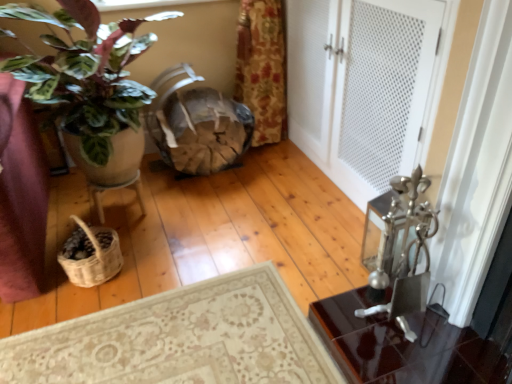
Question: Are woven natural fiber basket at lower left and matte brown pot at left far apart?

Choices:
 (A) yes
 (B) no

Answer: (B)

Question: Is woven natural fiber basket at lower left oriented away from matte brown pot at left?

Choices:
 (A) yes
 (B) no

Answer: (B)

Question: Is woven natural fiber basket at lower left aimed at matte brown pot at left?

Choices:
 (A) no
 (B) yes

Answer: (A)

Question: From the image's perspective, is woven natural fiber basket at lower left under matte brown pot at left?

Choices:
 (A) yes
 (B) no

Answer: (A)

Question: Is woven natural fiber basket at lower left bigger than matte brown pot at left?

Choices:
 (A) no
 (B) yes

Answer: (A)

Question: From a real-world perspective, is woven natural fiber basket at lower left over matte brown pot at left?

Choices:
 (A) yes
 (B) no

Answer: (B)

Question: From a real-world perspective, is wooden textured basket at center below matte brown pot at left?

Choices:
 (A) no
 (B) yes

Answer: (B)

Question: From a real-world perspective, is wooden textured basket at center positioned over matte brown pot at left based on gravity?

Choices:
 (A) yes
 (B) no

Answer: (B)

Question: Is matte brown pot at left surrounded by wooden textured basket at center?

Choices:
 (A) no
 (B) yes

Answer: (A)

Question: Would you say wooden textured basket at center is a long distance from matte brown pot at left?

Choices:
 (A) yes
 (B) no

Answer: (B)

Question: Can we say wooden textured basket at center lies outside matte brown pot at left?

Choices:
 (A) yes
 (B) no

Answer: (A)

Question: Does wooden textured basket at center have a lesser height compared to matte brown pot at left?

Choices:
 (A) yes
 (B) no

Answer: (A)

Question: Does wooden textured basket at center appear on the left side of white textured door at center?

Choices:
 (A) no
 (B) yes

Answer: (B)